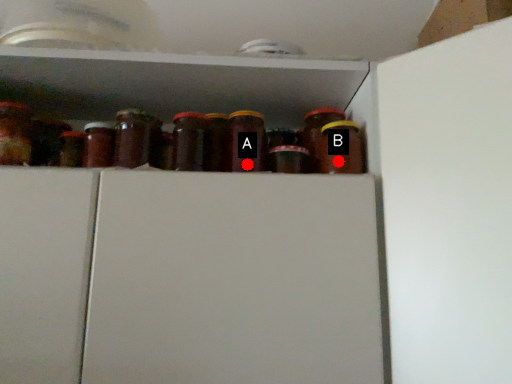
Question: Two points are circled on the image, labeled by A and B beside each circle. Which point appears farthest from the camera in this image?

Choices:
 (A) A is further
 (B) B is further

Answer: (A)